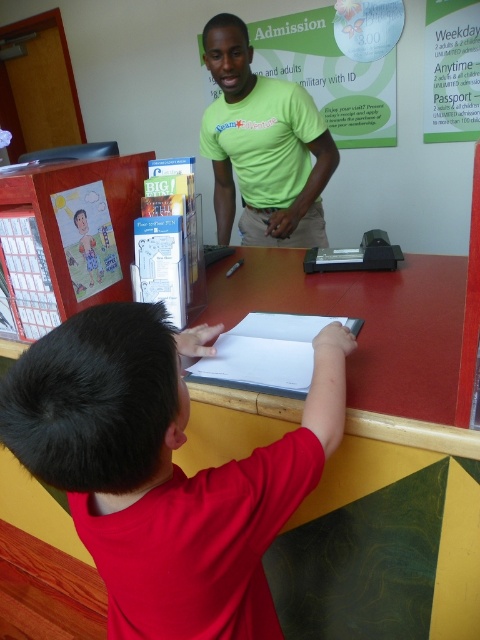
You are a visitor trying to find the ticket counter. You see a green matte shirt at center and a wooden desk at left. Which object is closer to you?

The green matte shirt at center is closer to you because it is larger in size than the wooden desk at left, indicating it is nearer in the scene.

You are a visitor approaching the counter at the visitor center. You see the red matte shirt at lower left and the wooden desk at left. Which object is closer to your right side as you face the counter?

The red matte shirt at lower left is to the right of the wooden desk at left. Since you are facing the counter, the red matte shirt at lower left would be closer to your right side.